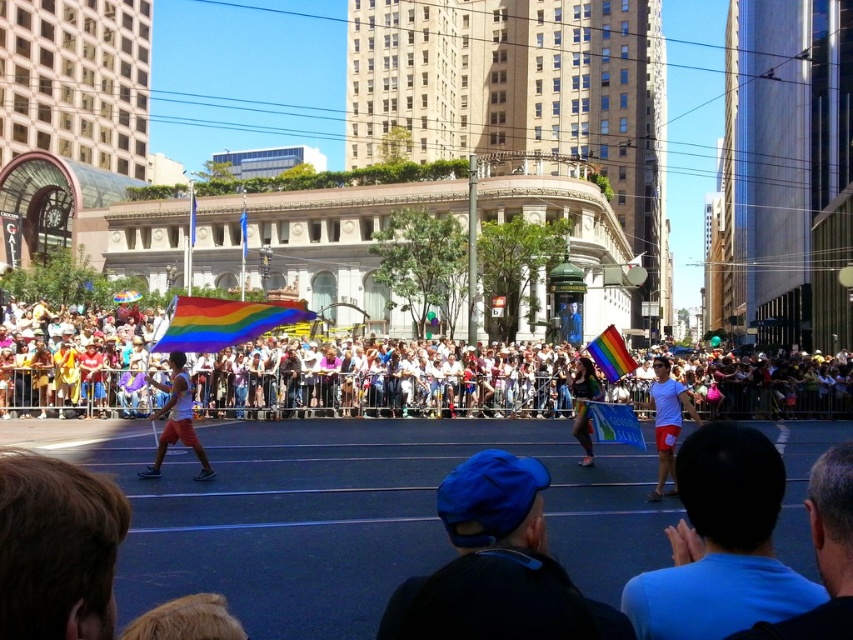
Question: Does rainbow fabric flag at center appear on the left side of blue fabric cap at upper center?

Choices:
 (A) yes
 (B) no

Answer: (A)

Question: Is brown hair at lower left in front of white matte shorts at left?

Choices:
 (A) no
 (B) yes

Answer: (B)

Question: Which object is the farthest from the blue fabric cap at center?

Choices:
 (A) white cotton crowd at center
 (B) white matte shorts at center
 (C) rainbow fabric flag at center

Answer: (A)

Question: Can you confirm if rainbow fabric flag at center is wider than white matte shorts at center?

Choices:
 (A) no
 (B) yes

Answer: (B)

Question: Considering the real-world distances, which object is closest to the rainbow fabric flag at center?

Choices:
 (A) brown hair at lower left
 (B) blue fabric cap at center

Answer: (B)

Question: Which object is closer to the camera taking this photo?

Choices:
 (A) white matte shorts at center
 (B) rainbow fabric flag at center
 (C) white matte shorts at left
 (D) blue fabric cap at center

Answer: (D)